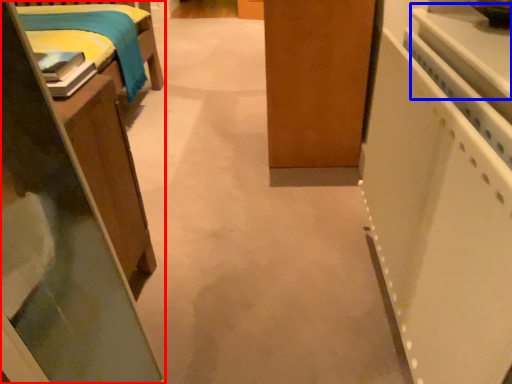
Question: Which of the following is the farthest to the observer, furniture (highlighted by a red box) or counter top (highlighted by a blue box)?

Choices:
 (A) furniture
 (B) counter top

Answer: (A)